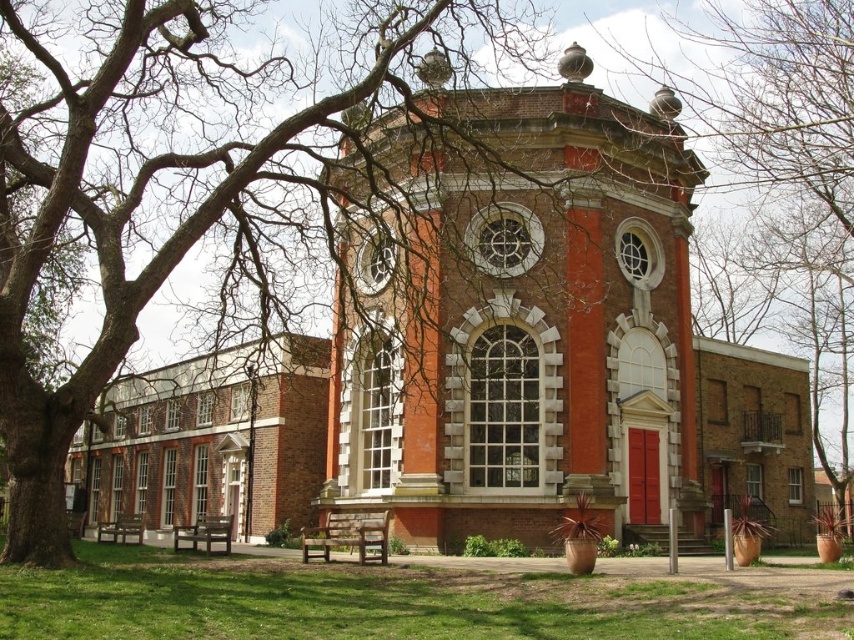
Can you confirm if bare branches at upper left is positioned to the left of bare branches at center?

Yes, bare branches at upper left is to the left of bare branches at center.

Can you confirm if bare branches at upper left is bigger than bare branches at center?

Yes, bare branches at upper left is bigger than bare branches at center.

In order to click on bare branches at upper left in this screenshot , I will do tap(183, 180).